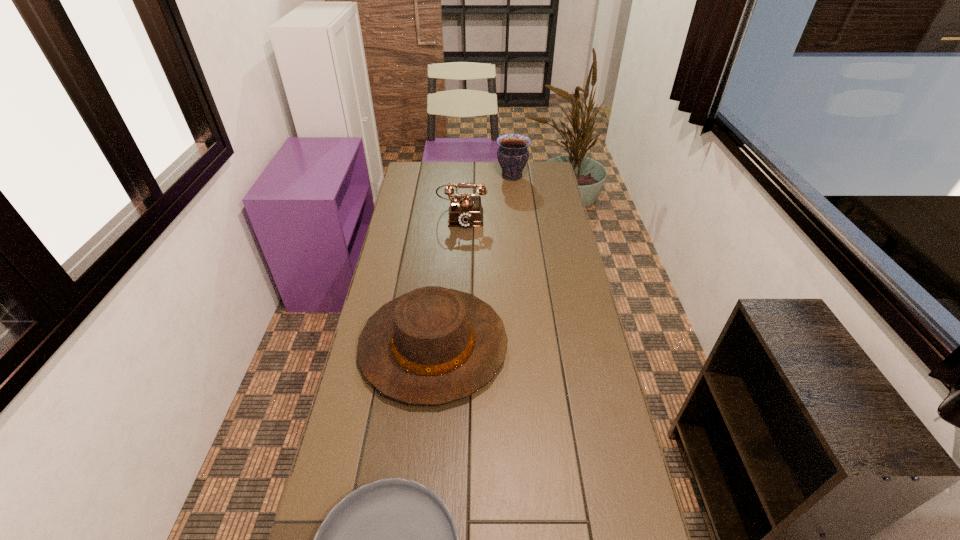
Where is `the farthest object`? This screenshot has height=540, width=960. the farthest object is located at coordinates (512, 154).

Locate an element on the screen. telephone is located at coordinates (465, 211).

The image size is (960, 540). In order to click on the second nearest object in this screenshot , I will do `click(432, 346)`.

At what (x,y) coordinates should I click in order to perform the action: click on blank area located 0.310m on the front handle of the pottery. Please return your answer as a coordinate pair (x, y). This screenshot has height=540, width=960. Looking at the image, I should click on (432, 176).

This screenshot has height=540, width=960. Identify the location of vacant position located 0.160m on the front handle of the pottery. coord(463,176).

I want to click on vacant space located on the front handle of the pottery, so click(x=483, y=176).

Where is `vacant region located on the dial of the third nearest object`? vacant region located on the dial of the third nearest object is located at coordinates (459, 282).

In order to click on vacant space situated 0.190m on the front of the second nearest object in this screenshot , I will do `click(420, 480)`.

Find the location of a particular element. object that is at the far edge is located at coordinates (512, 154).

You are a GUI agent. You are given a task and a screenshot of the screen. Output one action in this format:
    pyautogui.click(x=<x>, y=<y>)
    Task: Click on the object at the left edge
    Image resolution: width=960 pixels, height=540 pixels.
    Given the screenshot: What is the action you would take?
    pyautogui.click(x=432, y=346)